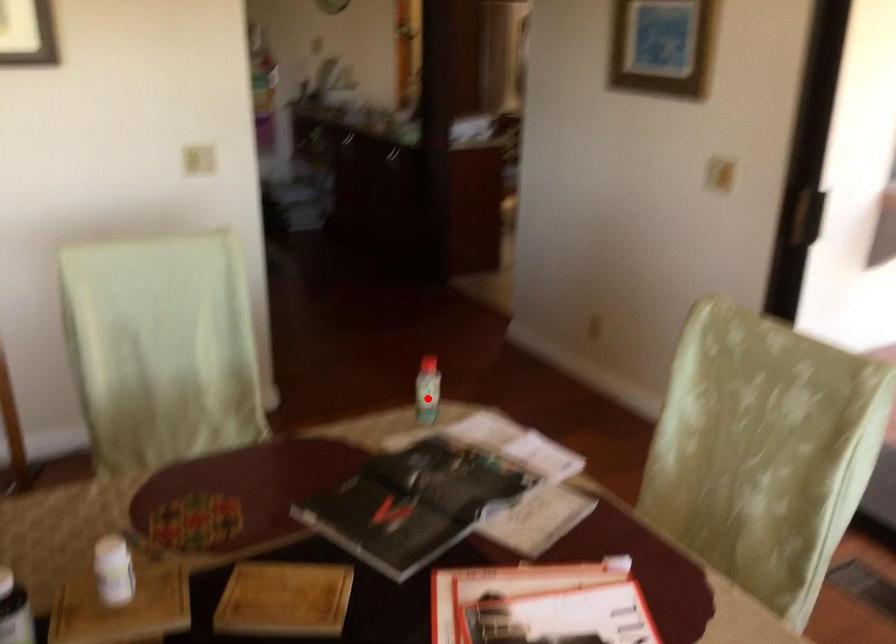
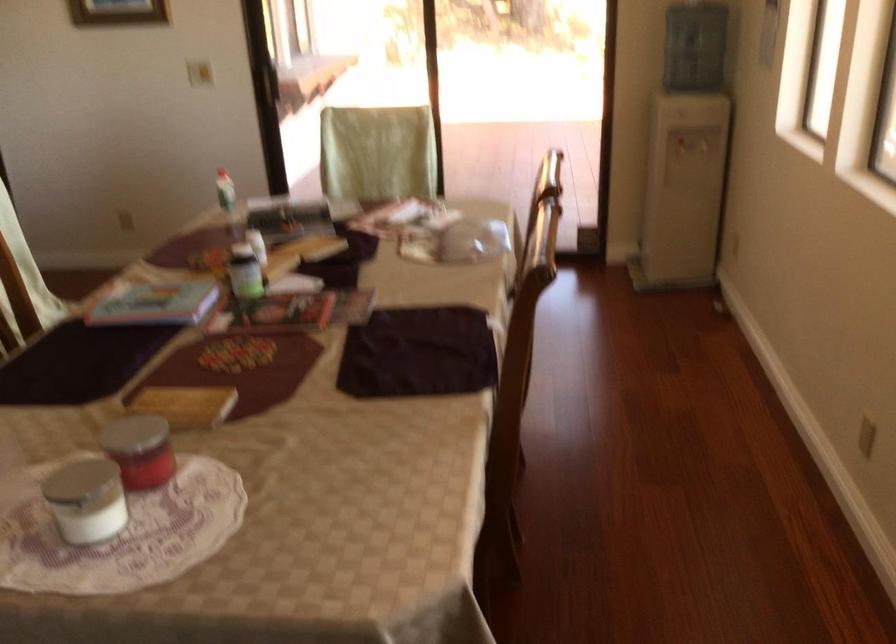
Question: I am providing you with two images of the same scene from different viewpoints. Given a red point in image1, look at the same physical point in image2. Is it:

Choices:
 (A) Closer to the viewpoint
 (B) Farther from the viewpoint

Answer: (B)